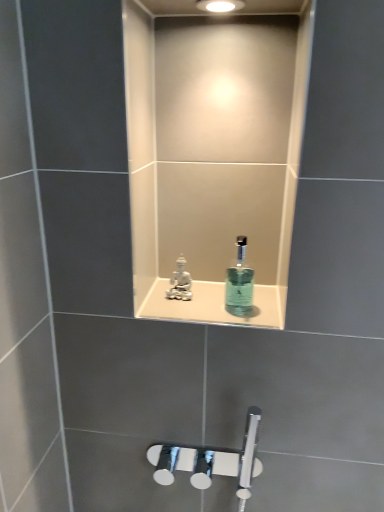
What are the coordinates of `vacant space behind translucent glass mouthwash at center` in the screenshot? It's located at tap(225, 298).